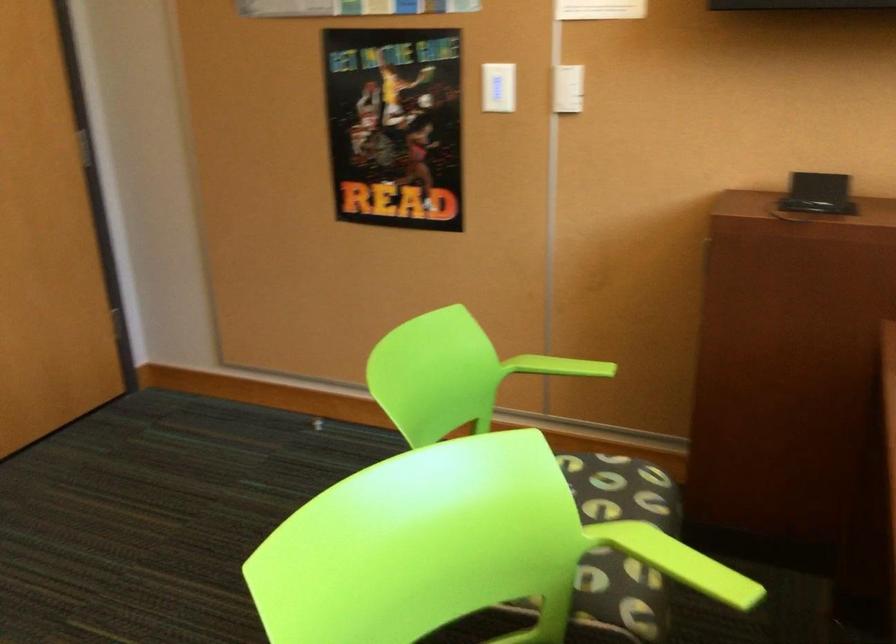
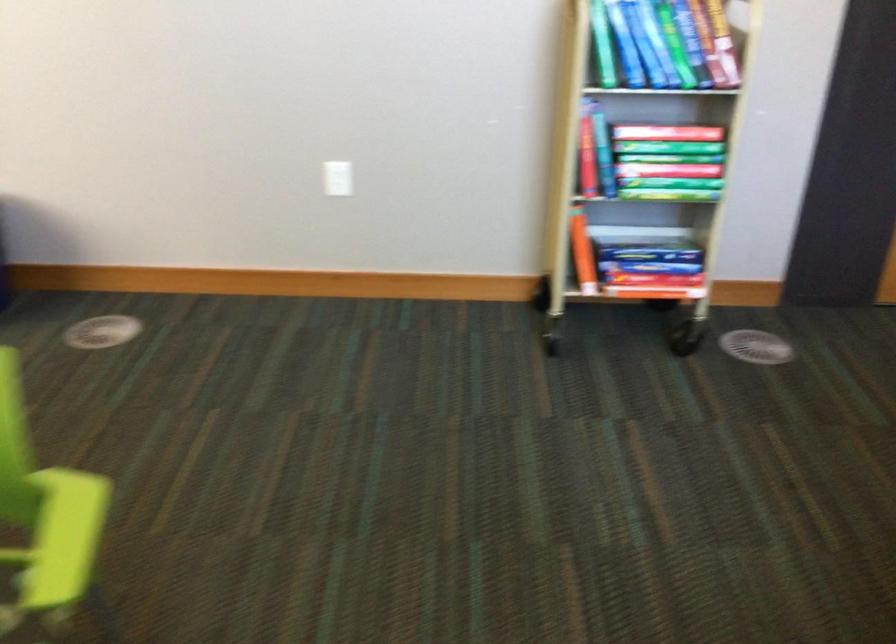
Based on the continuous images, in which direction is the camera rotating?

The camera's rotation is toward left-down.